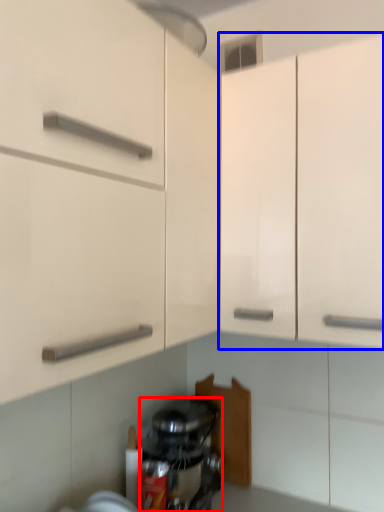
Question: Which object appears farthest to the camera in this image, home appliance (highlighted by a red box) or cabinetry (highlighted by a blue box)?

Choices:
 (A) home appliance
 (B) cabinetry

Answer: (A)